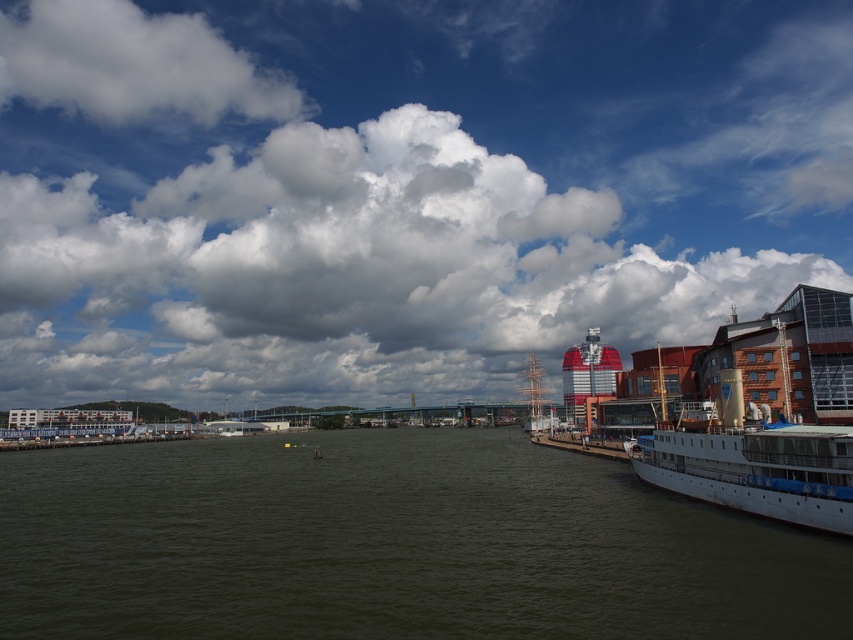
Question: Estimate the real-world distances between objects in this image. Which object is closer to the white fluffy cloud at upper left?

Choices:
 (A) white fluffy cloud at upper center
 (B) wooden dock at center

Answer: (A)

Question: Is white fluffy cloud at upper center positioned at the back of greenish-brown water at center?

Choices:
 (A) yes
 (B) no

Answer: (A)

Question: Is white fluffy cloud at upper left positioned behind white matte ship at lower right?

Choices:
 (A) yes
 (B) no

Answer: (A)

Question: Which of the following is the farthest from the observer?

Choices:
 (A) (744, 438)
 (B) (550, 442)
 (C) (126, 77)
 (D) (676, 525)

Answer: (C)

Question: Does white fluffy cloud at upper center appear under white fluffy cloud at upper left?

Choices:
 (A) no
 (B) yes

Answer: (B)

Question: Among these points, which one is farthest from the camera?

Choices:
 (A) (4, 324)
 (B) (816, 449)
 (C) (605, 444)
 (D) (260, 556)

Answer: (A)